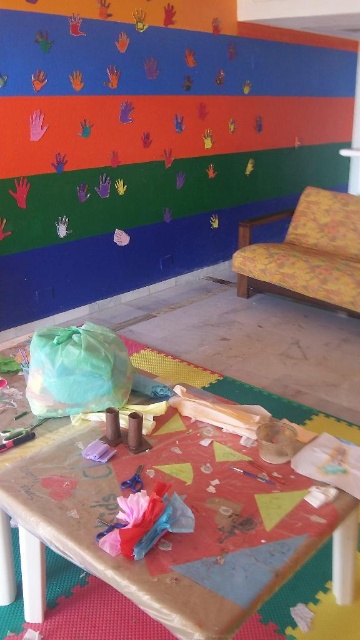
Who is lower down, wrinkled brown paper at center or yellow floral fabric sofa at right?

wrinkled brown paper at center is below.

Describe the element at coordinates (214, 528) in the screenshot. The width and height of the screenshot is (360, 640). I see `wrinkled brown paper at center` at that location.

Find the location of a particular element. wrinkled brown paper at center is located at coordinates (214, 528).